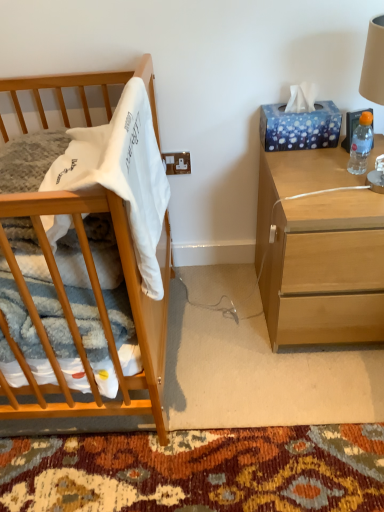
Identify the location of blue glossy tissue box at upper right. This screenshot has width=384, height=512. (299, 127).

This screenshot has width=384, height=512. What do you see at coordinates (361, 144) in the screenshot?
I see `clear plastic bottle at right` at bounding box center [361, 144].

What do you see at coordinates (326, 270) in the screenshot? Image resolution: width=384 pixels, height=512 pixels. I see `light wood nightstand at right` at bounding box center [326, 270].

What do you see at coordinates (101, 311) in the screenshot?
I see `light brown wood crib at left` at bounding box center [101, 311].

Image resolution: width=384 pixels, height=512 pixels. Describe the element at coordinates (122, 174) in the screenshot. I see `white soft fabric at left` at that location.

Where is `blue glossy tissue box at upper right`? blue glossy tissue box at upper right is located at coordinates (299, 127).

Can you confirm if white soft fabric at left is bigger than light wood nightstand at right?

Actually, white soft fabric at left might be smaller than light wood nightstand at right.

How many degrees apart are the facing directions of white soft fabric at left and light wood nightstand at right?

white soft fabric at left and light wood nightstand at right are facing 90 degrees away from each other.

Locate an element on the screen. The width and height of the screenshot is (384, 512). nightstand located behind the white soft fabric at left is located at coordinates (326, 270).

Considering the positions of points (85, 179) and (374, 206), is point (85, 179) farther from camera compared to point (374, 206)?

No, it is not.

Is clear plastic bottle at right a part of light brown wood crib at left?

No, clear plastic bottle at right is not inside light brown wood crib at left.

Between light brown wood crib at left and clear plastic bottle at right, which one has larger width?

light brown wood crib at left is wider.

Is light brown wood crib at left bigger than clear plastic bottle at right?

Indeed, light brown wood crib at left has a larger size compared to clear plastic bottle at right.

From the image's perspective, between light brown wood crib at left and blue glossy tissue box at upper right, who is located below?

light brown wood crib at left is shown below in the image.

Between point (155, 374) and point (262, 111), which one is positioned behind?

The point (262, 111) is behind.

Is light brown wood crib at left oriented towards blue glossy tissue box at upper right?

No, light brown wood crib at left does not turn towards blue glossy tissue box at upper right.

Between white soft fabric at left and blue glossy tissue box at upper right, which one appears on the left side from the viewer's perspective?

Positioned to the left is white soft fabric at left.

Looking at this image, from the image's perspective, is white soft fabric at left on top of blue glossy tissue box at upper right?

No, from the image's perspective, white soft fabric at left is not on top of blue glossy tissue box at upper right.

Are white soft fabric at left and blue glossy tissue box at upper right far apart?

No, white soft fabric at left is not far from blue glossy tissue box at upper right.

Considering the positions of objects clear plastic bottle at right and light wood nightstand at right in the image provided, who is more to the right, clear plastic bottle at right or light wood nightstand at right?

clear plastic bottle at right is more to the right.

Is clear plastic bottle at right aimed at light wood nightstand at right?

No, clear plastic bottle at right is not turned towards light wood nightstand at right.

Considering the sizes of objects clear plastic bottle at right and light wood nightstand at right in the image provided, who is bigger, clear plastic bottle at right or light wood nightstand at right?

Bigger between the two is light wood nightstand at right.

Based on the photo, can you tell me how much blue glossy tissue box at upper right and white soft fabric at left differ in facing direction?

blue glossy tissue box at upper right and white soft fabric at left are facing 90 degrees away from each other.

From the image's perspective, is blue glossy tissue box at upper right on white soft fabric at left?

Indeed, from the image's perspective, blue glossy tissue box at upper right is shown above white soft fabric at left.

Based on their positions, is blue glossy tissue box at upper right located to the left or right of white soft fabric at left?

blue glossy tissue box at upper right is to the right of white soft fabric at left.

Are blue glossy tissue box at upper right and white soft fabric at left making contact?

No, blue glossy tissue box at upper right is not making contact with white soft fabric at left.

Is light wood nightstand at right smaller than clear plastic bottle at right?

No.

Is light wood nightstand at right with clear plastic bottle at right?

No, light wood nightstand at right is not in contact with clear plastic bottle at right.

Is light wood nightstand at right turned away from clear plastic bottle at right?

No, clear plastic bottle at right is not at the back of light wood nightstand at right.

What are the coordinates of `blanket that is above the light wood nightstand at right (from a real-world perspective)` in the screenshot? It's located at (122, 174).

You are a GUI agent. You are given a task and a screenshot of the screen. Output one action in this format:
    pyautogui.click(x=<x>, y=<y>)
    Task: Click on the cabinetry below the clear plastic bottle at right (from a real-world perspective)
    Image resolution: width=384 pixels, height=512 pixels.
    Given the screenshot: What is the action you would take?
    pyautogui.click(x=101, y=311)

Based on their spatial positions, is clear plastic bottle at right or blue glossy tissue box at upper right closer to light wood nightstand at right?

clear plastic bottle at right lies closer to light wood nightstand at right than the other object.

Considering their positions, is white soft fabric at left positioned further to light brown wood crib at left than blue glossy tissue box at upper right?

blue glossy tissue box at upper right.

Looking at the image, which one is located further to white soft fabric at left, light brown wood crib at left or light wood nightstand at right?

light wood nightstand at right is positioned further to the anchor white soft fabric at left.

From the image, which object appears to be nearer to white soft fabric at left, clear plastic bottle at right or light brown wood crib at left?

light brown wood crib at left.

Which object lies nearer to the anchor point light wood nightstand at right, clear plastic bottle at right or light brown wood crib at left?

The object closer to light wood nightstand at right is clear plastic bottle at right.

Based on their spatial positions, is blue glossy tissue box at upper right or light wood nightstand at right further from white soft fabric at left?

Based on the image, blue glossy tissue box at upper right appears to be further to white soft fabric at left.

Based on their spatial positions, is white soft fabric at left or light wood nightstand at right closer to blue glossy tissue box at upper right?

light wood nightstand at right.

When comparing their distances from light wood nightstand at right, does blue glossy tissue box at upper right or white soft fabric at left seem closer?

blue glossy tissue box at upper right lies closer to light wood nightstand at right than the other object.

Where is `bottle between blue glossy tissue box at upper right and light wood nightstand at right in the vertical direction`? bottle between blue glossy tissue box at upper right and light wood nightstand at right in the vertical direction is located at coordinates (361, 144).

Where is `tissue paper between light brown wood crib at left and clear plastic bottle at right in the horizontal direction`? tissue paper between light brown wood crib at left and clear plastic bottle at right in the horizontal direction is located at coordinates (299, 127).

Where is `blanket between light brown wood crib at left and light wood nightstand at right`? The image size is (384, 512). blanket between light brown wood crib at left and light wood nightstand at right is located at coordinates (122, 174).

Where is `tissue paper located between light brown wood crib at left and light wood nightstand at right in the left-right direction`? tissue paper located between light brown wood crib at left and light wood nightstand at right in the left-right direction is located at coordinates (299, 127).